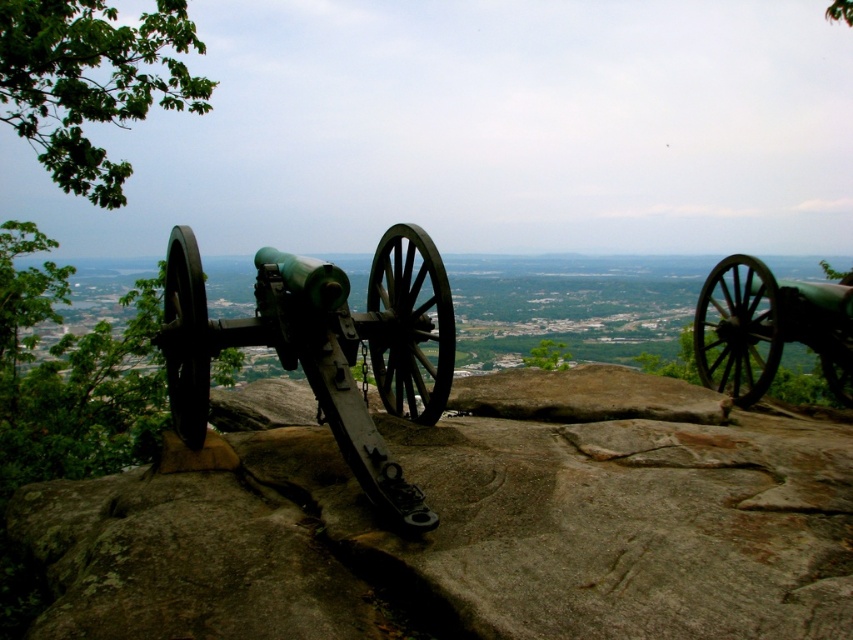
You are an art conservator assessing the cannons in the image. Which cannon, the green matte cannon at center or the green matte cannon at right, is taller?

The green matte cannon at center is taller than the green matte cannon at right.

You are a historian examining the cannon and its surroundings. You notice a smooth gray rock at center. Can you determine its exact 2D coordinates in the image?

The smooth gray rock at center is located at the 2D coordinates of point (463,536).

You are a historian examining the cannon and its surroundings. You notice a specific point marked at coordinates (x=463, y=536). Based on the scene, can you determine what surface this point is located on?

The point at (x=463, y=536) is located on a smooth gray rock at center, which is part of the rocky outcrop where the cannon is positioned.